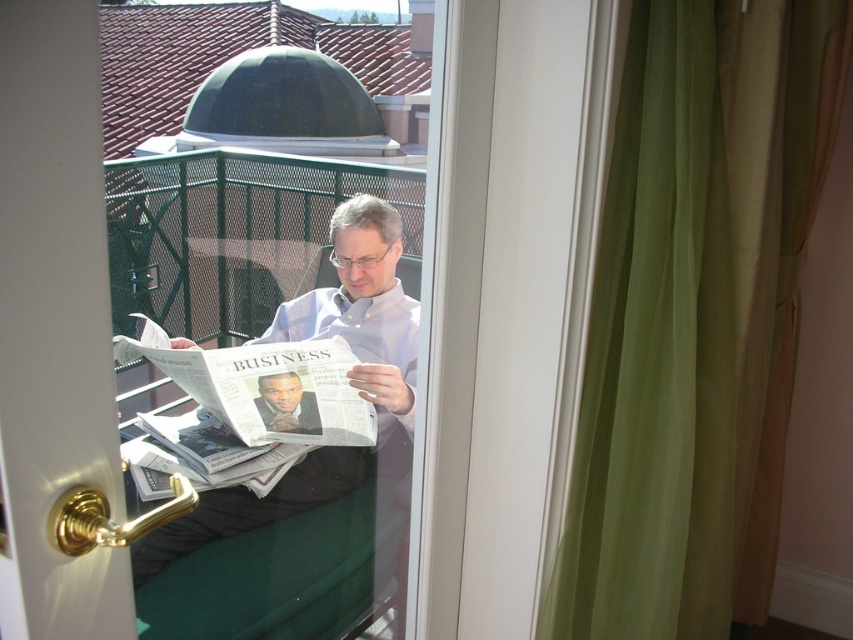
Can you confirm if white glossy door at center is positioned below matte black newspaper at center?

No.

Who is more distant from viewer, (x=28, y=60) or (x=309, y=422)?

The point (x=309, y=422) is more distant.

Find the location of a particular element. Image resolution: width=853 pixels, height=640 pixels. white glossy door at center is located at coordinates (53, 324).

Who is lower down, white glossy door at center or light gray shirt at center?

Positioned lower is light gray shirt at center.

Between white glossy door at center and light gray shirt at center, which one is positioned higher?

white glossy door at center is higher up.

Who is more forward, (x=91, y=186) or (x=396, y=248)?

Point (x=91, y=186) is in front.

You are a GUI agent. You are given a task and a screenshot of the screen. Output one action in this format:
    pyautogui.click(x=<x>, y=<y>)
    Task: Click on the white glossy door at center
    
    Given the screenshot: What is the action you would take?
    pyautogui.click(x=53, y=324)

Between green fabric curtain at right and light gray shirt at center, which one appears on the right side from the viewer's perspective?

Positioned to the right is green fabric curtain at right.

Who is more forward, [643,378] or [358,449]?

Point [643,378] is more forward.

You are a GUI agent. You are given a task and a screenshot of the screen. Output one action in this format:
    pyautogui.click(x=<x>, y=<y>)
    Task: Click on the green fabric curtain at right
    The image size is (853, 640).
    Given the screenshot: What is the action you would take?
    pyautogui.click(x=692, y=314)